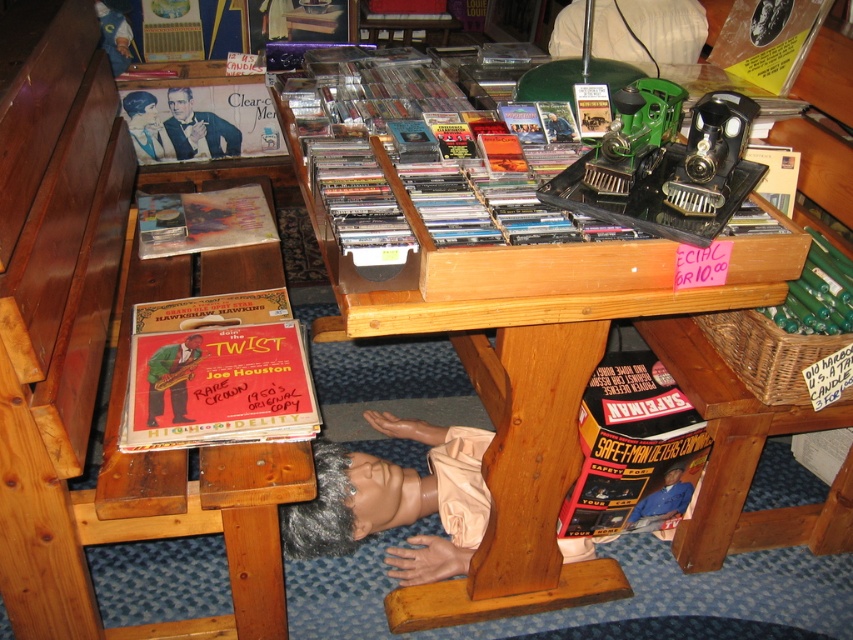
Which is more to the left, matte vinyl record at lower left or matte black record album at upper left?

matte black record album at upper left

Is matte vinyl record at lower left positioned at the back of matte black record album at upper left?

That is False.

Who is more distant from viewer, [196,355] or [184,90]?

Point [184,90]

Where is `matte vinyl record at lower left`? The width and height of the screenshot is (853, 640). matte vinyl record at lower left is located at coordinates (216, 372).

Identify the location of hardcover book at lower right. (631, 449).

Who is more forward, (650, 380) or (137, 200)?

Positioned in front is point (650, 380).

Is point (592, 486) in front of point (268, 228)?

Yes.

Find the location of a particular element. This screenshot has width=853, height=640. hardcover book at lower right is located at coordinates (631, 449).

Is point (505, 513) in front of point (647, 496)?

Yes, it is in front of point (647, 496).

Which of these two, wooden table at center or smooth beige mannequin head at lower center, stands shorter?

With less height is smooth beige mannequin head at lower center.

Does point (520, 432) come closer to viewer compared to point (668, 516)?

Yes, it is.

I want to click on wooden table at center, so click(x=524, y=429).